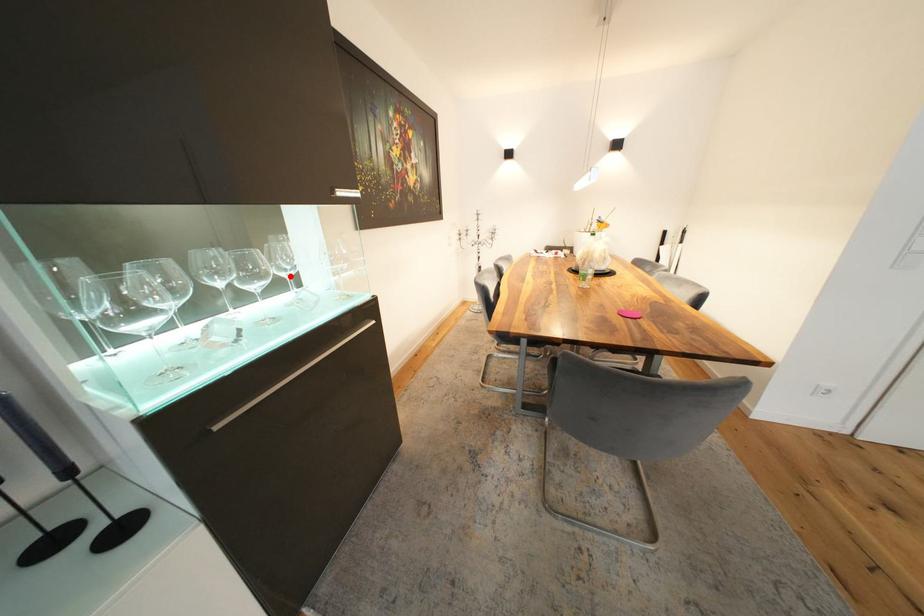
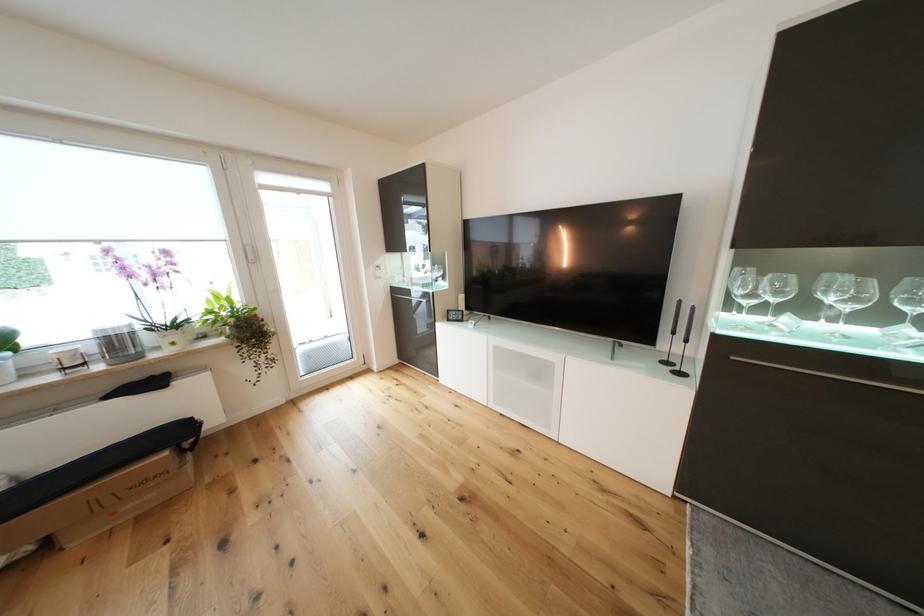
In the second image, find the point that corresponds to the highlighted location in the first image.

(913, 310)